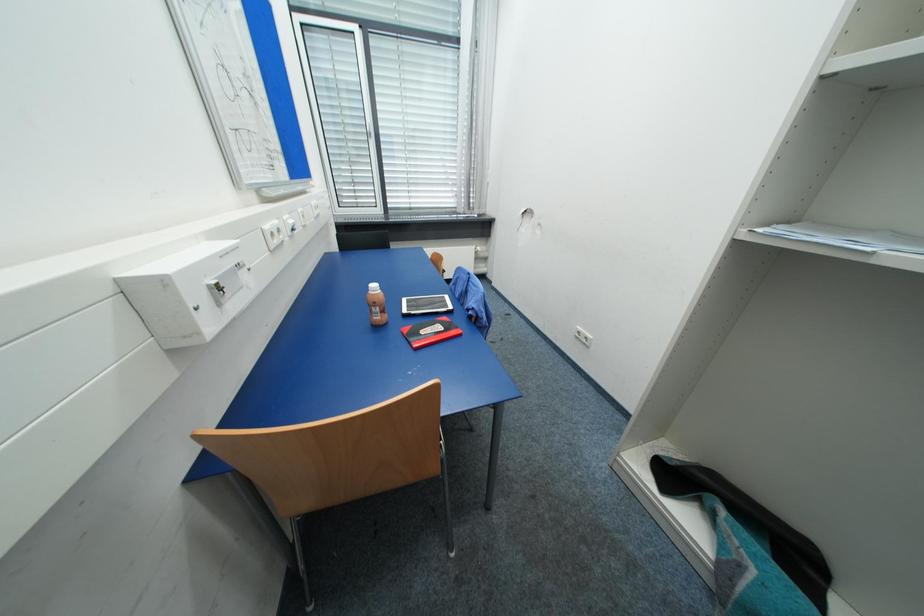
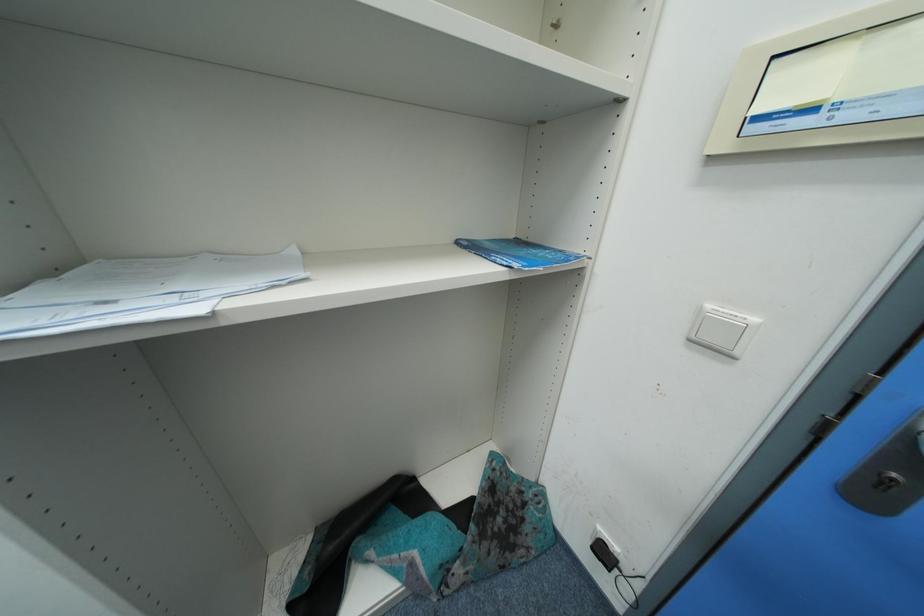
Consider the image. The first image is from the beginning of the video and the second image is from the end. How did the camera likely rotate when shooting the video?

The camera rotated toward right-down.